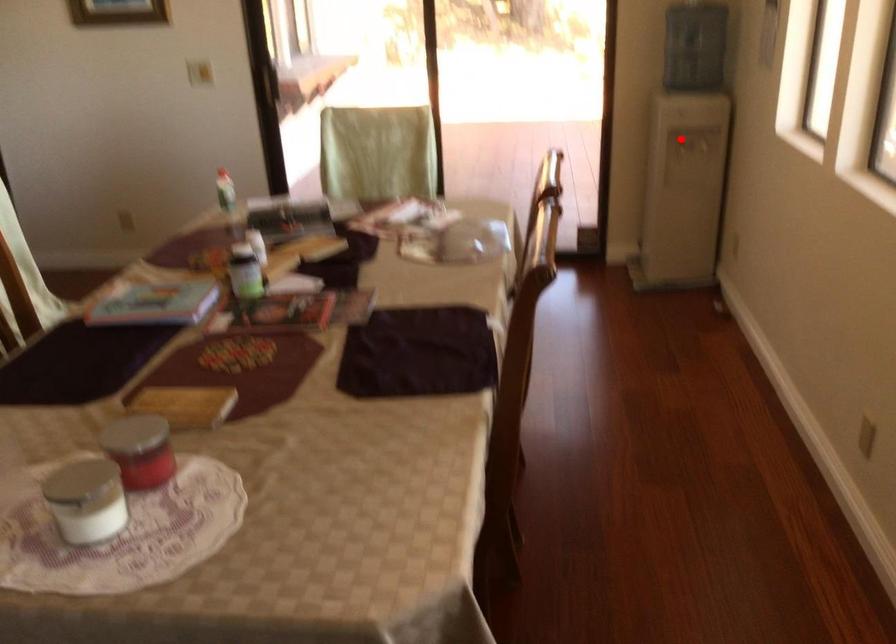
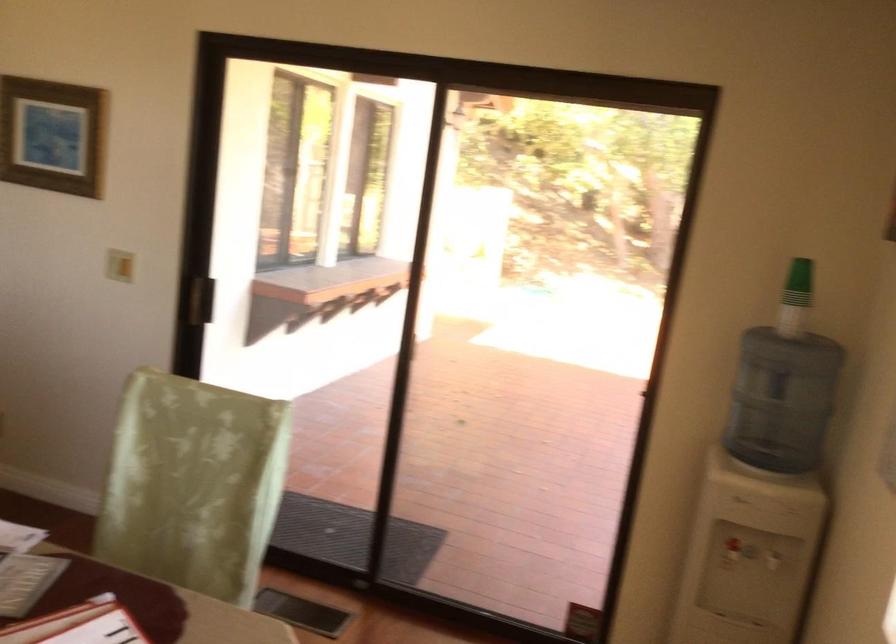
Question: I am providing you with two images of the same scene from different viewpoints. A red point is marked on the first image. At the location where the point appears in image 1, is it still visible in image 2?

Choices:
 (A) Yes
 (B) No

Answer: (A)